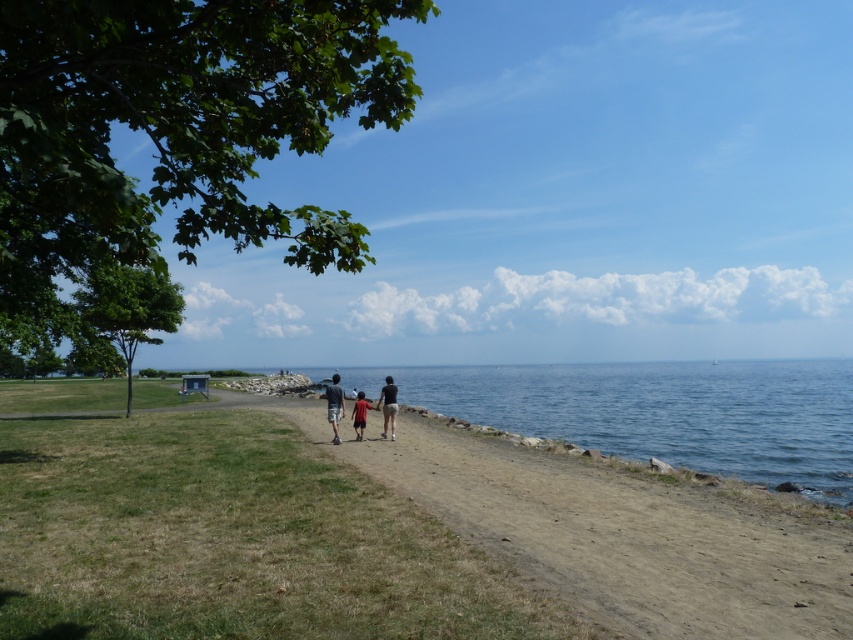
Who is positioned more to the left, matte gray shorts at center or red cotton shirt at center?

From the viewer's perspective, matte gray shorts at center appears more on the left side.

In the scene shown: Is matte gray shorts at center to the right of red cotton shirt at center from the viewer's perspective?

No, matte gray shorts at center is not to the right of red cotton shirt at center.

This screenshot has width=853, height=640. Describe the element at coordinates (334, 404) in the screenshot. I see `matte gray shorts at center` at that location.

What are the coordinates of `matte gray shorts at center` in the screenshot? It's located at (334, 404).

Between blue water at lower center and dark gray shorts at center, which one is positioned higher?

dark gray shorts at center is higher up.

Where is `blue water at lower center`? The height and width of the screenshot is (640, 853). blue water at lower center is located at coordinates (657, 412).

In the scene shown: Does dark gray shorts at center have a smaller size compared to red cotton shirt at center?

Indeed, dark gray shorts at center has a smaller size compared to red cotton shirt at center.

The width and height of the screenshot is (853, 640). Describe the element at coordinates (387, 404) in the screenshot. I see `dark gray shorts at center` at that location.

The width and height of the screenshot is (853, 640). In order to click on dark gray shorts at center in this screenshot , I will do coord(387,404).